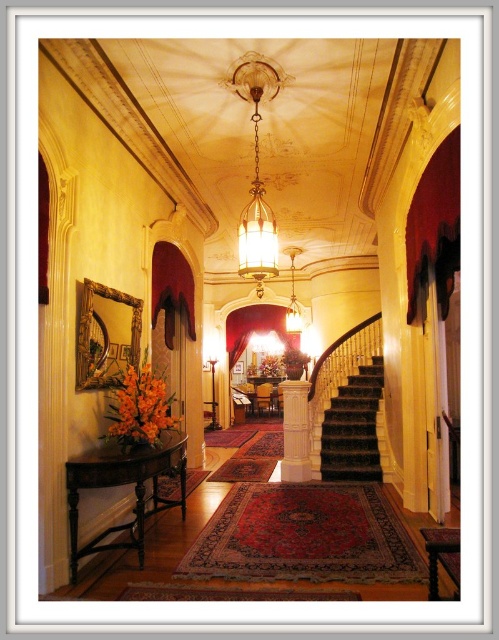
Does matte black console table at left have a smaller size compared to dark brown carpeted stairs at center?

Actually, matte black console table at left might be larger than dark brown carpeted stairs at center.

Which is in front, point (207, 307) or point (361, 388)?

Positioned in front is point (361, 388).

What are the coordinates of `matte black console table at left` in the screenshot? It's located at point(276,179).

Does dark brown carpeted stairs at center appear on the right side of translucent glass chandelier at center?

Correct, you'll find dark brown carpeted stairs at center to the right of translucent glass chandelier at center.

What do you see at coordinates (352, 428) in the screenshot? I see `dark brown carpeted stairs at center` at bounding box center [352, 428].

Locate an element on the screen. The image size is (499, 640). dark brown carpeted stairs at center is located at coordinates (352, 428).

Which of these two, matte black console table at left or translucent glass chandelier at center, stands taller?

Standing taller between the two is matte black console table at left.

Is matte black console table at left wider than translucent glass chandelier at center?

Correct, the width of matte black console table at left exceeds that of translucent glass chandelier at center.

Does point (398, 170) come in front of point (263, 236)?

No.

Locate an element on the screen. The height and width of the screenshot is (640, 499). matte black console table at left is located at coordinates (276, 179).